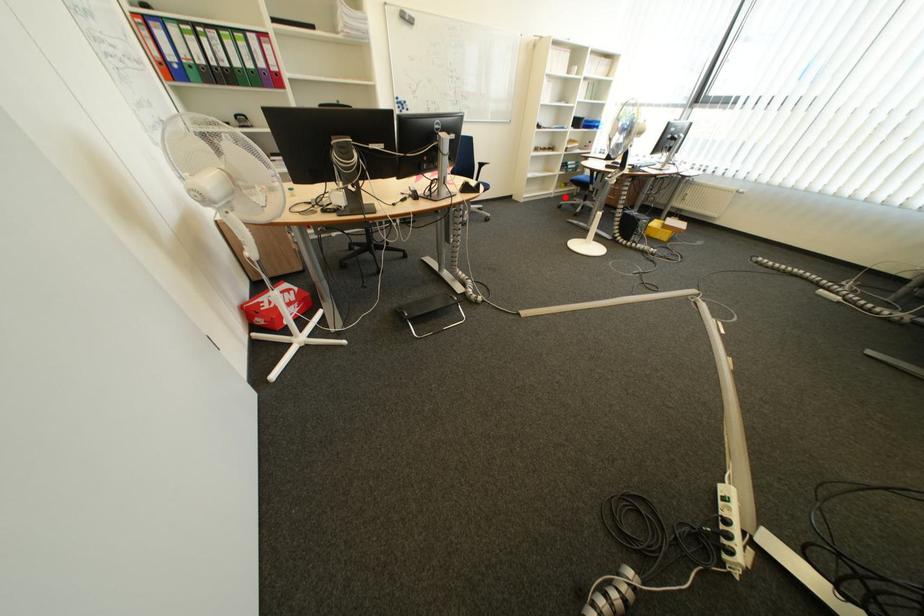
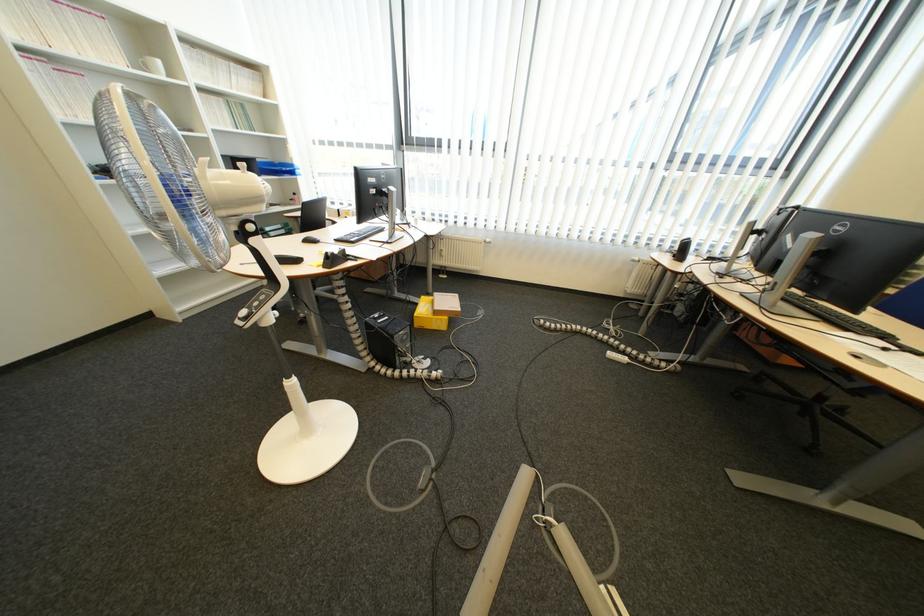
Where in the second image is the point corresponding to the highlighted location from the first image?

(277, 285)